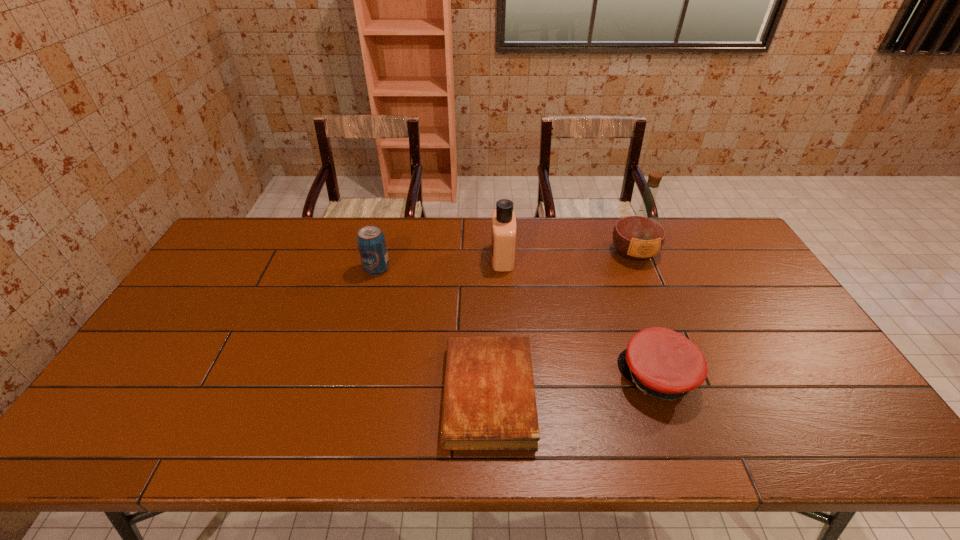
Identify the location of liquor. This screenshot has width=960, height=540. click(639, 235).

Identify the location of the second tallest object. (503, 233).

Find the location of a particular element. the third shortest object is located at coordinates (371, 242).

Image resolution: width=960 pixels, height=540 pixels. I want to click on the leftmost object, so click(x=371, y=242).

Where is `cap`? cap is located at coordinates (662, 363).

I want to click on the shortest object, so click(x=489, y=403).

You are a GUI agent. You are given a task and a screenshot of the screen. Output one action in this format:
    pyautogui.click(x=<x>, y=<y>)
    Task: Click on the vacant space located on the front label of the tallest object
    
    Given the screenshot: What is the action you would take?
    pyautogui.click(x=676, y=352)

Locate an element on the screen. The width and height of the screenshot is (960, 540). free space located on the front label of the perfume is located at coordinates (432, 257).

At what (x,y) coordinates should I click in order to perform the action: click on free space located 0.200m on the front label of the perfume. Please return your answer as a coordinate pair (x, y). This screenshot has height=540, width=960. Looking at the image, I should click on (432, 257).

Find the location of a particular element. free space located on the front label of the perfume is located at coordinates (438, 257).